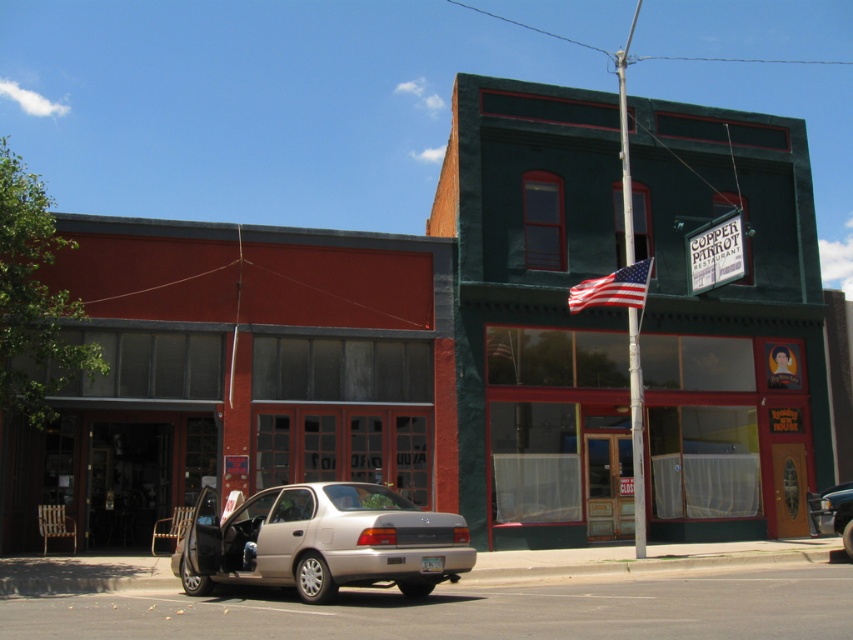
Question: Is green painted building at center behind matte red building at center?

Choices:
 (A) no
 (B) yes

Answer: (B)

Question: Is satin gold sedan at lower left to the right of metallic silver sedan at center from the viewer's perspective?

Choices:
 (A) yes
 (B) no

Answer: (B)

Question: Among these points, which one is farthest from the camera?

Choices:
 (A) (257, 529)
 (B) (639, 305)

Answer: (B)

Question: Is american flag at center thinner than metallic silver sedan at center?

Choices:
 (A) yes
 (B) no

Answer: (B)

Question: Which object is positioned farthest from the green painted building at center?

Choices:
 (A) satin gold sedan at lower left
 (B) metallic silver sedan at center
 (C) american flag at center
 (D) matte red building at center

Answer: (A)

Question: Which point is closer to the camera?

Choices:
 (A) satin gold sedan at lower left
 (B) metallic silver sedan at center
 (C) green painted building at center
 (D) american flag at center

Answer: (A)